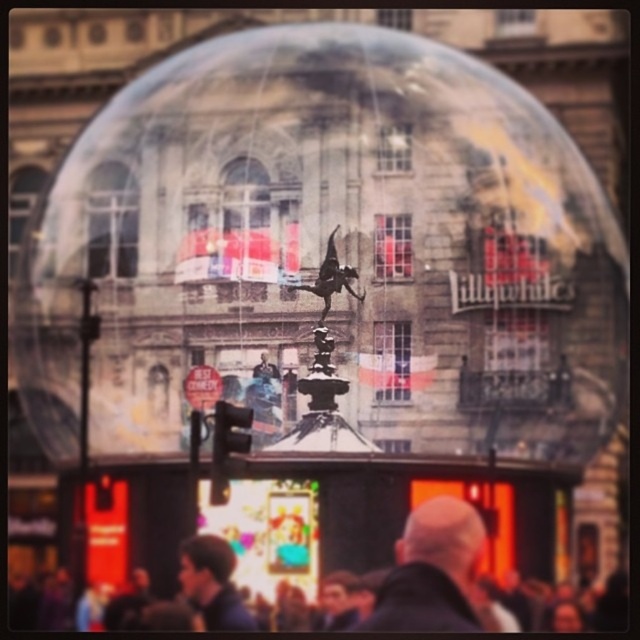
Question: Can you confirm if dark hair bald head at center is bigger than dark blue shirt at lower center?

Choices:
 (A) no
 (B) yes

Answer: (B)

Question: Which of the following is the farthest from the observer?

Choices:
 (A) (24, 614)
 (B) (465, 561)

Answer: (A)

Question: Among these points, which one is farthest from the camera?

Choices:
 (A) (173, 168)
 (B) (220, 625)

Answer: (A)

Question: Is dark gray fabric crowd at lower center thinner than dark blue shirt at lower center?

Choices:
 (A) no
 (B) yes

Answer: (A)

Question: Is transparent glass sphere at center positioned before dark blue shirt at lower center?

Choices:
 (A) no
 (B) yes

Answer: (A)

Question: Based on their relative distances, which object is farther from the transparent glass sphere at center?

Choices:
 (A) dark hair bald head at center
 (B) dark blue shirt at lower center

Answer: (B)